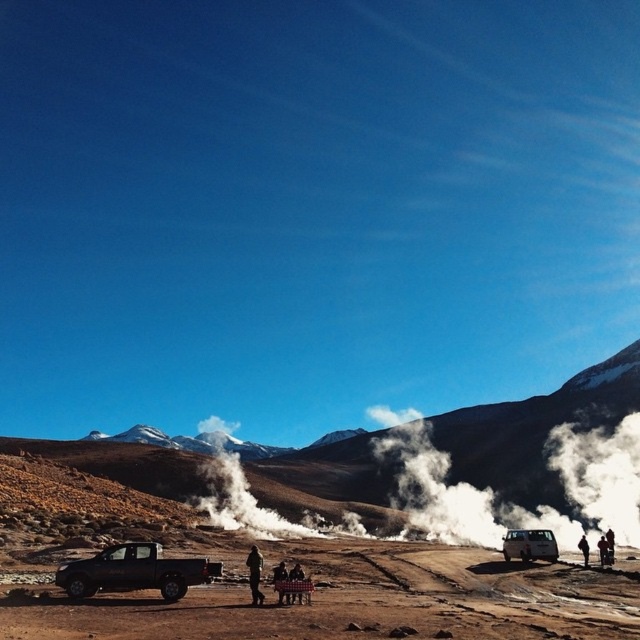
Question: From the image, what is the correct spatial relationship of brown rocky mountain at lower left in relation to smooth skin person at center?

Choices:
 (A) below
 (B) above

Answer: (A)

Question: Estimate the real-world distances between objects in this image. Which object is farther from the brown rocky mountain at lower left?

Choices:
 (A) dark brown leather jacket at lower right
 (B) plaid fabric person at center

Answer: (B)

Question: Which object is farther from the camera taking this photo?

Choices:
 (A) camouflage fabric jacket at center
 (B) plaid fabric person at center
 (C) matte silver van at lower right

Answer: (C)

Question: Which of the following is the closest to the observer?

Choices:
 (A) (598, 545)
 (B) (586, 552)
 (C) (532, 548)

Answer: (C)

Question: Can you confirm if brown sandy dirt field at center is bigger than plaid fabric pants at center?

Choices:
 (A) yes
 (B) no

Answer: (A)

Question: Is camouflage fabric jacket at center bigger than dark brown leather jacket at center?

Choices:
 (A) no
 (B) yes

Answer: (A)